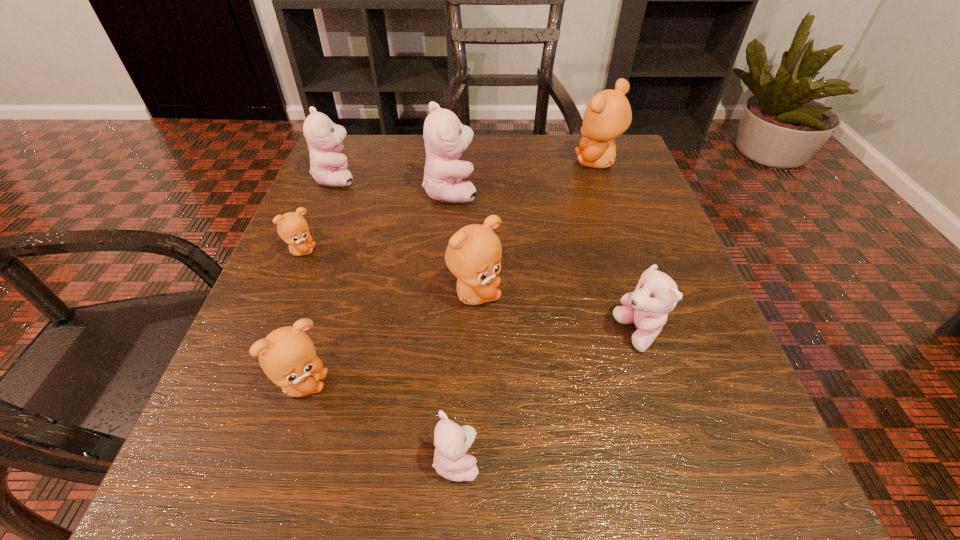
What are the coordinates of `brown teddy bear that is the closest to the fifth nearest object` in the screenshot? It's located at (287, 355).